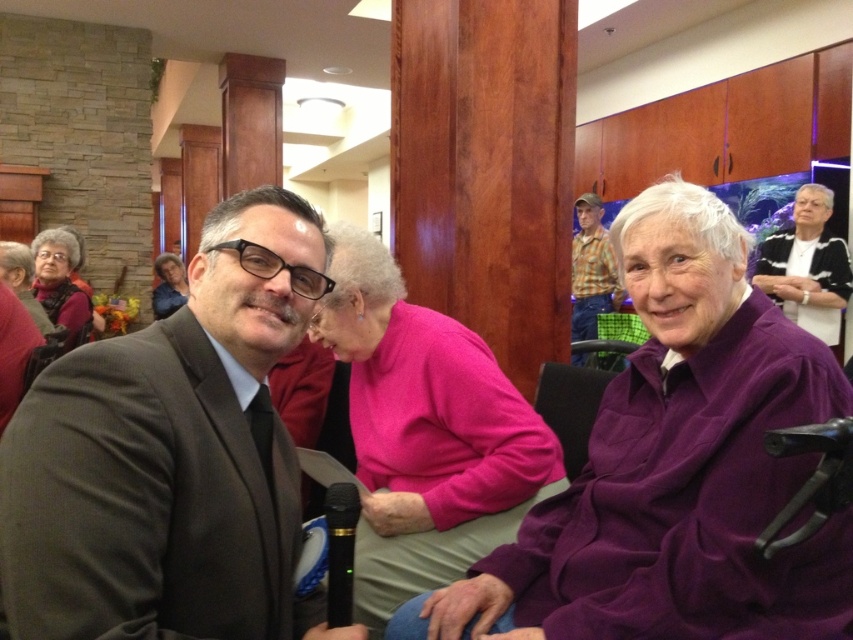
Question: Does purple fleece jacket at center have a larger size compared to checkered flannel shirt at upper center?

Choices:
 (A) yes
 (B) no

Answer: (B)

Question: Which of the following is the farthest from the observer?

Choices:
 (A) (164, 608)
 (B) (746, 496)

Answer: (B)

Question: Which object is the closest to the matte pink sweater at center?

Choices:
 (A) purple fleece jacket at center
 (B) checkered flannel shirt at upper center
 (C) pink fleece sweater at center

Answer: (B)

Question: Does pink fleece sweater at center have a greater width compared to matte black sweater at upper left?

Choices:
 (A) no
 (B) yes

Answer: (B)

Question: Among these objects, which one is farthest from the camera?

Choices:
 (A) white textured sweater at upper right
 (B) dark brown suit at center

Answer: (A)

Question: Is pink fleece sweater at center smaller than checkered flannel shirt at upper center?

Choices:
 (A) yes
 (B) no

Answer: (A)